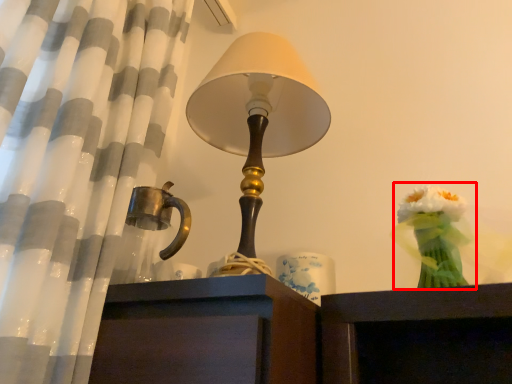
Question: From the image's perspective, what is the correct spatial relationship of floral arrangement (annotated by the red box) in relation to candle holder?

Choices:
 (A) below
 (B) above

Answer: (B)